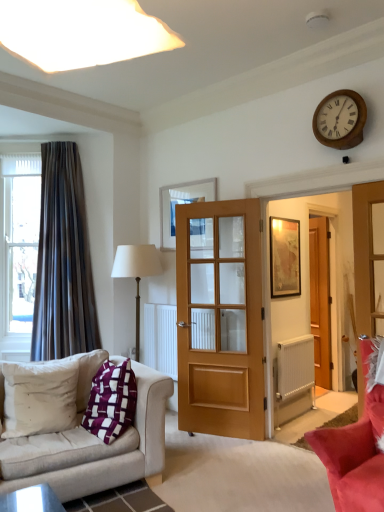
Question: From the image's perspective, is purple fabric pillow at lower left, the 2th pillow viewed from the left, positioned above or below white textured radiator at lower right?

Choices:
 (A) below
 (B) above

Answer: (B)

Question: Is purple fabric pillow at lower left, positioned as the 1th pillow in right-to-left order, wider or thinner than white textured radiator at lower right?

Choices:
 (A) thin
 (B) wide

Answer: (B)

Question: Estimate the real-world distances between objects in this image. Which object is closer to the velvet red sofa at lower right, acting as the second studio couch starting from the left?

Choices:
 (A) white soft cushion at lower left, arranged as the 2th pillow when viewed from the right
 (B) dark grey velvet curtain at left
 (C) wooden door at center, the second door viewed from the front
 (D) light brown wooden door at center, which is the 1th door in front-to-back order
 (E) beige fabric couch at lower left, the 1th studio couch positioned from the left

Answer: (E)

Question: Which object is the farthest from the beige fabric couch at lower left, the 2th studio couch viewed from the right?

Choices:
 (A) dark grey velvet curtain at left
 (B) clear glass window at left
 (C) light brown wooden door at center, the 1th door in the left-to-right sequence
 (D) wooden door at center, the 1th door positioned from the right
 (E) white soft cushion at lower left, the 1th pillow from the left

Answer: (D)